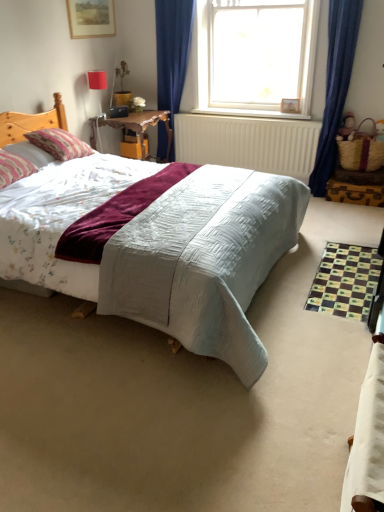
Question: From the image's perspective, is wooden picture frame at upper left above or below braided straw picnic basket at right?

Choices:
 (A) below
 (B) above

Answer: (B)

Question: Is wooden picture frame at upper left to the left or to the right of braided straw picnic basket at right in the image?

Choices:
 (A) right
 (B) left

Answer: (B)

Question: Based on their relative distances, which object is nearer to the wooden table at center?

Choices:
 (A) transparent glass window at upper center
 (B) pink fabric pillow at left, the 2th pillow viewed from the front
 (C) wooden picture frame at upper left
 (D) matte red lampshade at upper left
 (E) white fabric bed at lower right

Answer: (D)

Question: Considering the real-world distances, which object is closest to the wooden table at center?

Choices:
 (A) pink striped pillow at left, which is counted as the 2th pillow, starting from the back
 (B) matte red lampshade at upper left
 (C) transparent glass window at upper center
 (D) braided straw picnic basket at right
 (E) wooden picture frame at upper left

Answer: (B)